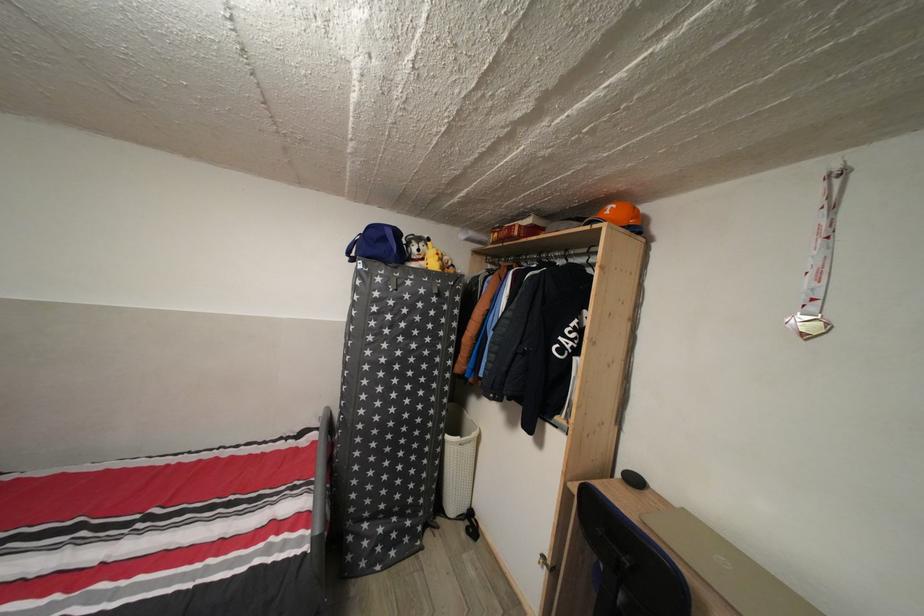
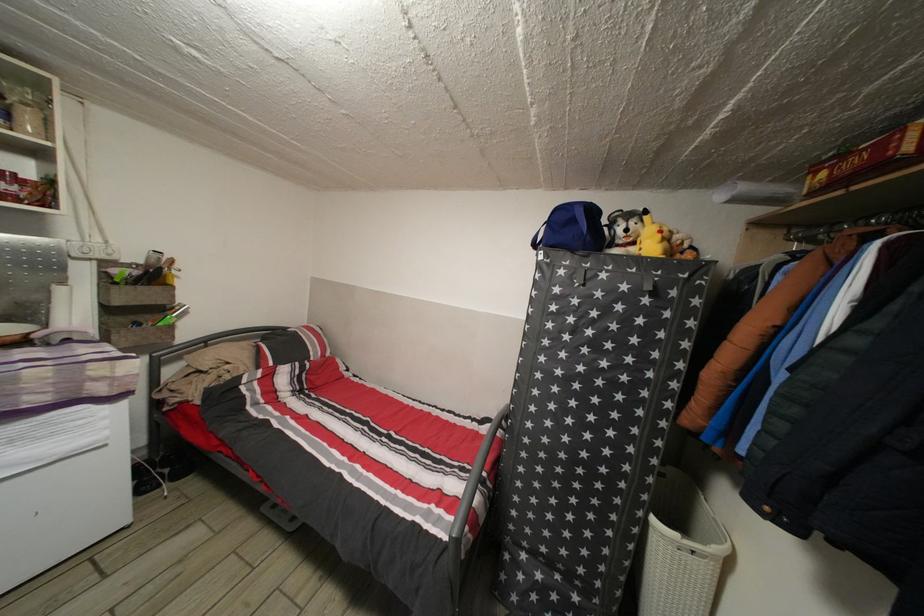
Question: The camera is either moving clockwise (left) or counter-clockwise (right) around the object. The first image is from the beginning of the video and the second image is from the end. Is the camera moving left or right when shooting the video?

Choices:
 (A) Left
 (B) Right

Answer: (B)